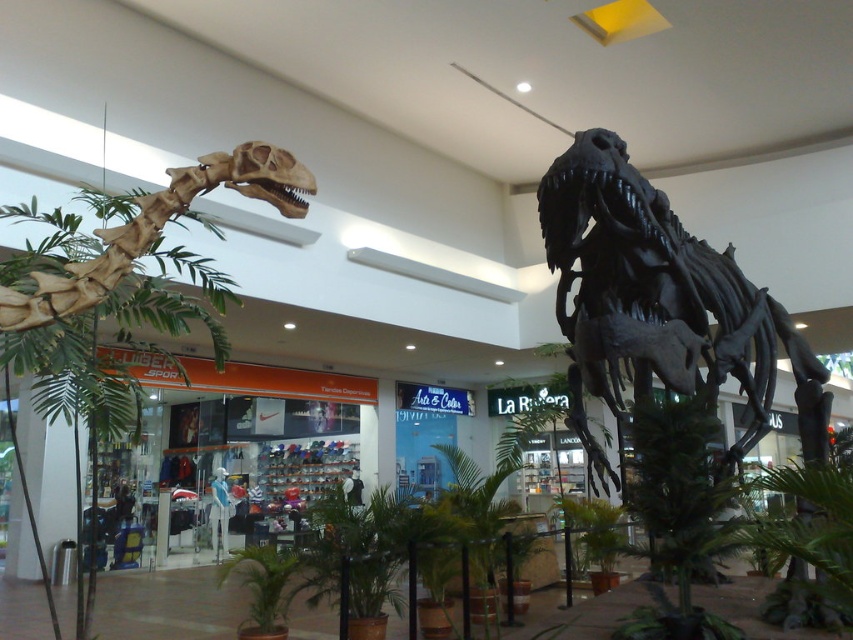
Question: Based on their relative distances, which object is farther from the green leafy plant at center?

Choices:
 (A) black matte skeleton at center
 (B) green leafy palm tree at left

Answer: (A)

Question: Can you confirm if black matte skeleton at center is wider than green leafy plant at center?

Choices:
 (A) yes
 (B) no

Answer: (A)

Question: Can you confirm if black matte skeleton at center is positioned above green leafy plant at center?

Choices:
 (A) yes
 (B) no

Answer: (A)

Question: Which point is farther to the camera?

Choices:
 (A) (595, 337)
 (B) (276, 632)

Answer: (B)

Question: Is black matte skeleton at center bigger than green leafy palm tree at left?

Choices:
 (A) no
 (B) yes

Answer: (B)

Question: Which object is farther from the camera taking this photo?

Choices:
 (A) green leafy plant at center
 (B) green leafy palm tree at left
 (C) black matte skeleton at center

Answer: (A)